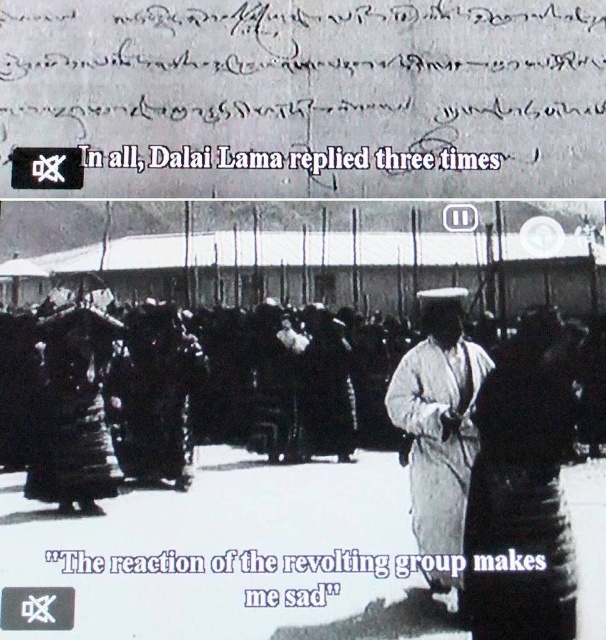
Which of these two, dark fabric dress at center or black paper text at center, stands taller?

dark fabric dress at center is taller.

Between point (538, 525) and point (493, 570), which one is positioned behind?

The point (538, 525) is more distant.

Identify the location of dark fabric dress at center. The width and height of the screenshot is (606, 640). (522, 488).

You are a GUI agent. You are given a task and a screenshot of the screen. Output one action in this format:
    pyautogui.click(x=<x>, y=<y>)
    Task: Click on the dark fabric dress at center
    
    Given the screenshot: What is the action you would take?
    pyautogui.click(x=522, y=488)

Find the location of a particular element. white cotton robe at center is located at coordinates (438, 419).

Who is positioned more to the left, white cotton robe at center or black paper text at center?

From the viewer's perspective, black paper text at center appears more on the left side.

You are a GUI agent. You are given a task and a screenshot of the screen. Output one action in this format:
    pyautogui.click(x=<x>, y=<y>)
    Task: Click on the white cotton robe at center
    The height and width of the screenshot is (640, 606).
    Given the screenshot: What is the action you would take?
    pyautogui.click(x=438, y=419)

Is dark fabric dress at center shorter than white cotton robe at center?

No.

Can you confirm if dark fabric dress at center is positioned to the right of white cotton robe at center?

Indeed, dark fabric dress at center is positioned on the right side of white cotton robe at center.

Where is `dark fabric dress at center`? This screenshot has width=606, height=640. dark fabric dress at center is located at coordinates (522, 488).

Find the location of a particular element. This screenshot has height=640, width=606. dark fabric dress at center is located at coordinates (522, 488).